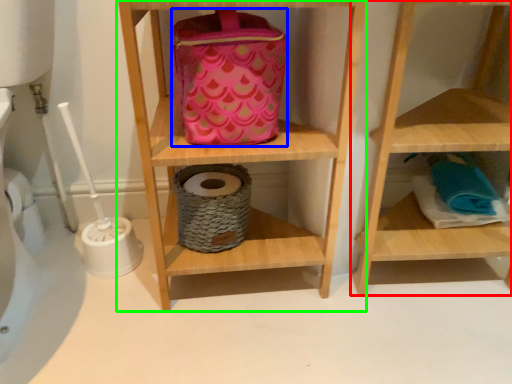
Question: Which is farther away from shelf (highlighted by a red box)? pouch (highlighted by a blue box) or shelf (highlighted by a green box)?

Choices:
 (A) pouch
 (B) shelf

Answer: (A)